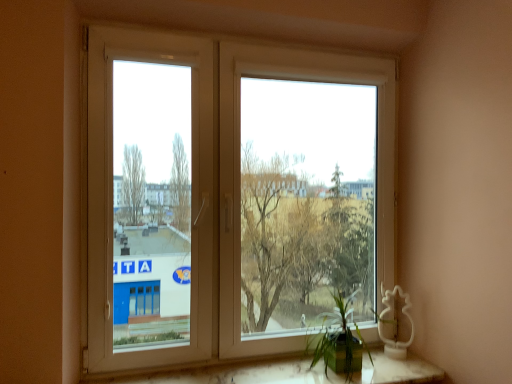
Where is `blank space situated above white plastic window at left (from a real-world perspective)`? blank space situated above white plastic window at left (from a real-world perspective) is located at coordinates (150, 32).